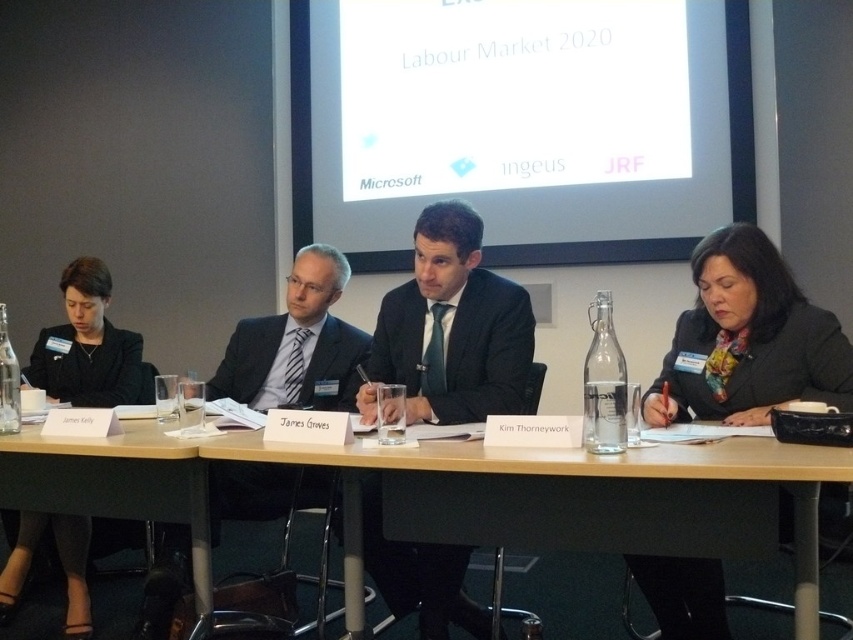
You are standing 1.5 meters away from the table in the meeting room. Can you reach the point at coordinates point (817, 365) on the table without moving closer?

The distance of point (817, 365) is 2.00 meters from the viewer, so you are currently 1.5 meters away. Since the point is further away than your current distance, you cannot reach it without moving closer.

You are a server at a banquet hall and need to place a 1.5 meter long platter between the wooden table at center and the black fabric jacket at left. Can you fit it there?

The wooden table at center and the black fabric jacket at left are 1.44 meters apart, so the 1.5 meter platter cannot fit between them as it is longer than the available space.